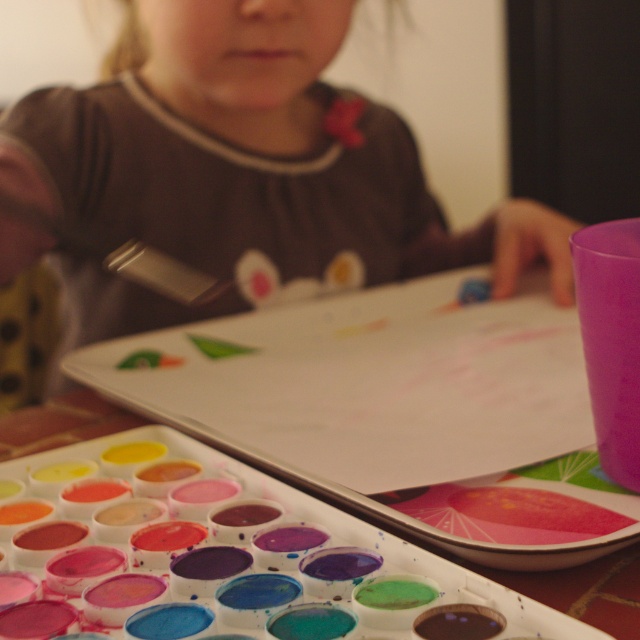
Question: Does white plastic tray at center appear on the left side of metallic silver paint brush at upper center?

Choices:
 (A) yes
 (B) no

Answer: (B)

Question: Among these objects, which one is farthest from the camera?

Choices:
 (A) white plastic tray at center
 (B) metallic silver paint brush at upper center
 (C) matte brown shirt at center

Answer: (B)

Question: Where is matte brown shirt at center located in relation to metallic silver paint brush at upper center in the image?

Choices:
 (A) above
 (B) below

Answer: (A)

Question: Which point appears farthest from the camera in this image?

Choices:
 (A) (230, 544)
 (B) (179, 262)

Answer: (B)

Question: Where is white plastic tray at center located in relation to metallic silver paint brush at upper center in the image?

Choices:
 (A) below
 (B) above

Answer: (A)

Question: Which point is closer to the camera?

Choices:
 (A) metallic silver paint brush at upper center
 (B) white plastic tray at center

Answer: (B)